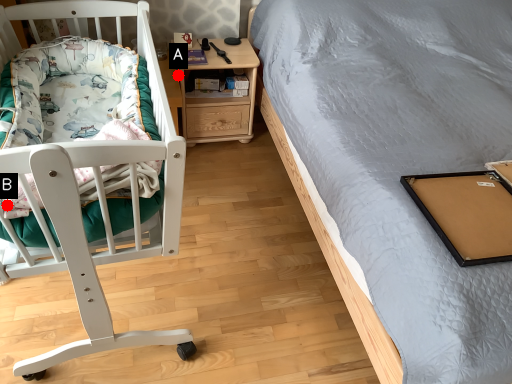
Question: Two points are circled on the image, labeled by A and B beside each circle. Which point is closer to the camera taking this photo?

Choices:
 (A) A is closer
 (B) B is closer

Answer: (B)